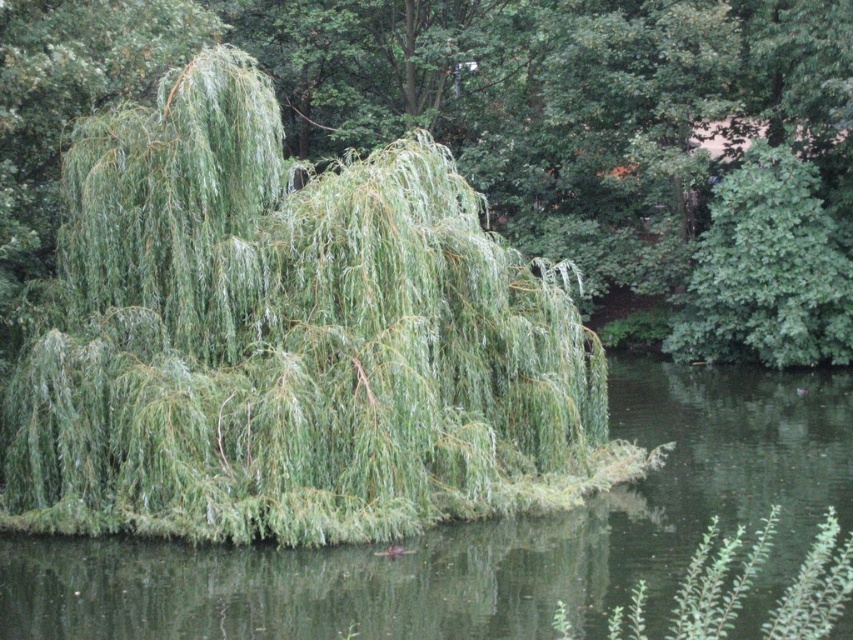
You are standing at the center of the image. Which direction should you move to get closer to the green leafy willow at center?

The green leafy willow at center is already at the center of the image, so you don not need to move in any direction to get closer.

You are standing in a park and see the green leafy willow at center. If you want to take a photo of it from 10 meters away, can you step forward or backward to achieve the desired distance?

The green leafy willow at center is currently 11.44 meters away. To take a photo from 10 meters away, you should step forward by 1.44 meters.